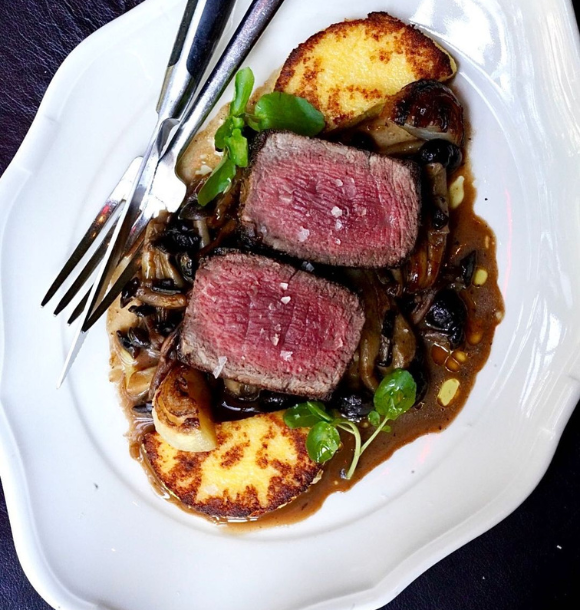
You are a GUI agent. You are given a task and a screenshot of the screen. Output one action in this format:
    pyautogui.click(x=<x>, y=<y>)
    Task: Click on the food on plate
    
    Given the screenshot: What is the action you would take?
    pyautogui.click(x=284, y=260)